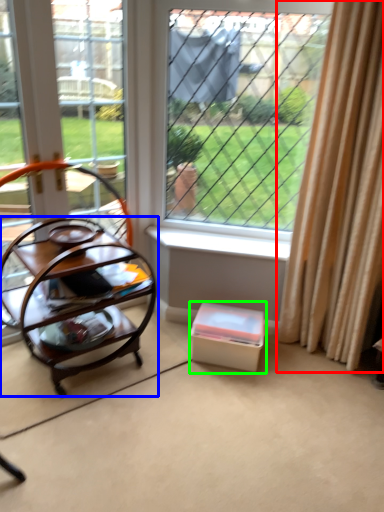
Question: Which object is the farthest from curtain (highlighted by a red box)? Choose among these: table (highlighted by a blue box) or storage box (highlighted by a green box).

Choices:
 (A) table
 (B) storage box

Answer: (A)